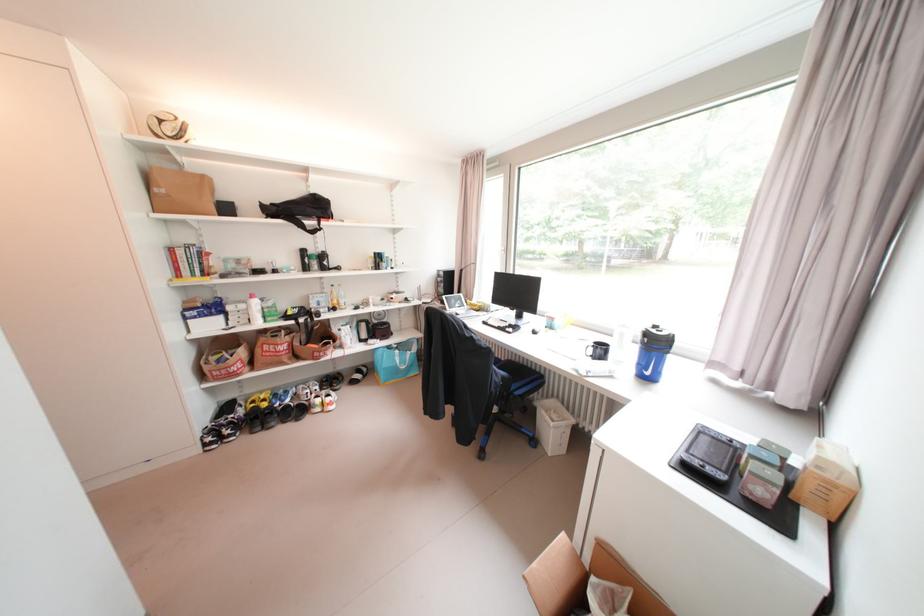
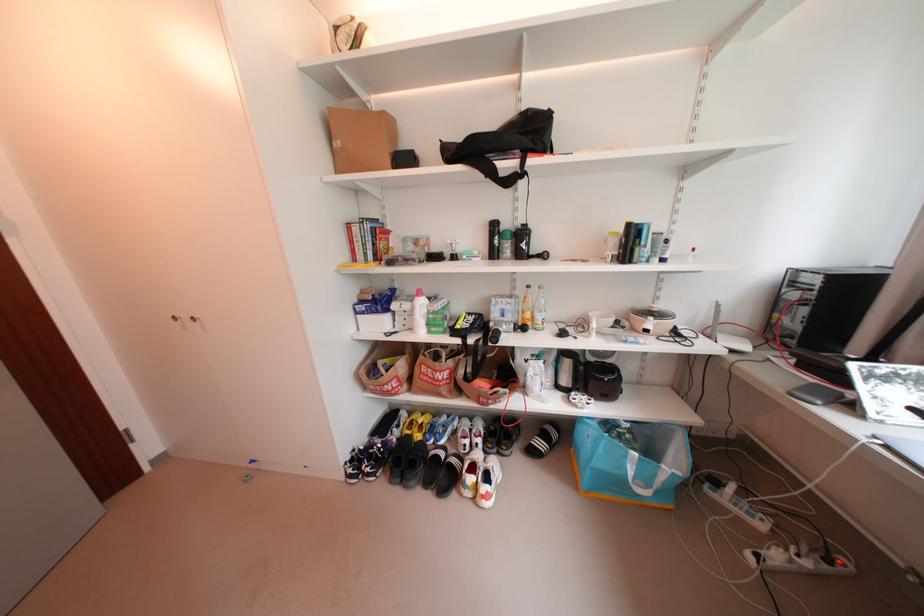
Find the pixel in the second image that matches (375,339) in the first image.

(578, 387)